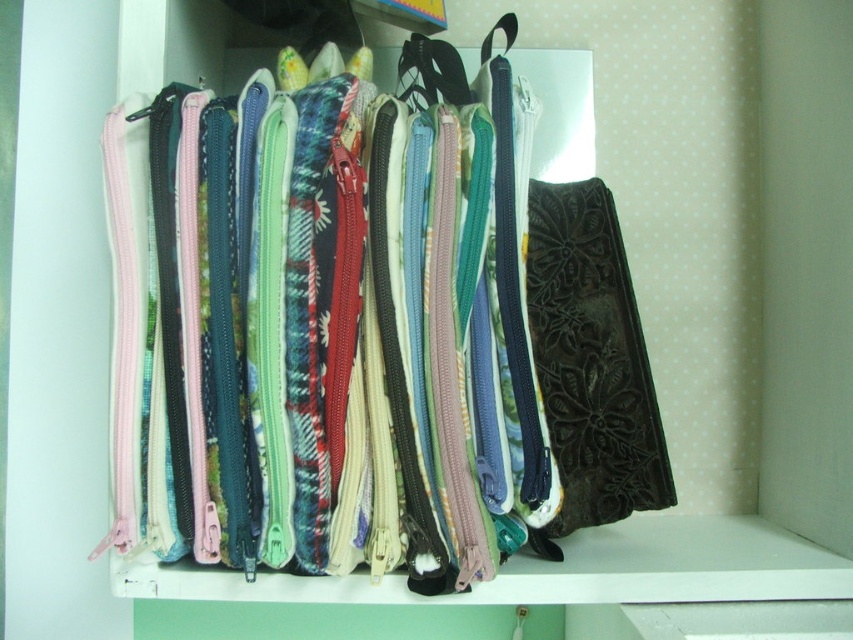
Question: Where is velvet floral pouch at center located in relation to matte black zipper at center in the image?

Choices:
 (A) right
 (B) left

Answer: (A)

Question: Considering the real-world distances, which object is farthest from the textured fabric zipper pouches at center?

Choices:
 (A) matte black strap at center
 (B) velvet floral pouch at center

Answer: (A)

Question: Which of the following is the closest to the observer?

Choices:
 (A) (762, 566)
 (B) (554, 333)
 (C) (416, 84)
 (D) (399, 154)

Answer: (D)

Question: Which of these objects is positioned farthest from the textured fabric zipper pouches at center?

Choices:
 (A) velvet floral pouch at center
 (B) matte black strap at center
 (C) matte black zipper at center

Answer: (B)

Question: Does textured fabric zipper pouches at center have a greater width compared to matte black strap at center?

Choices:
 (A) no
 (B) yes

Answer: (B)

Question: In this image, where is velvet floral pouch at center located relative to matte black zipper at center?

Choices:
 (A) above
 (B) below

Answer: (A)